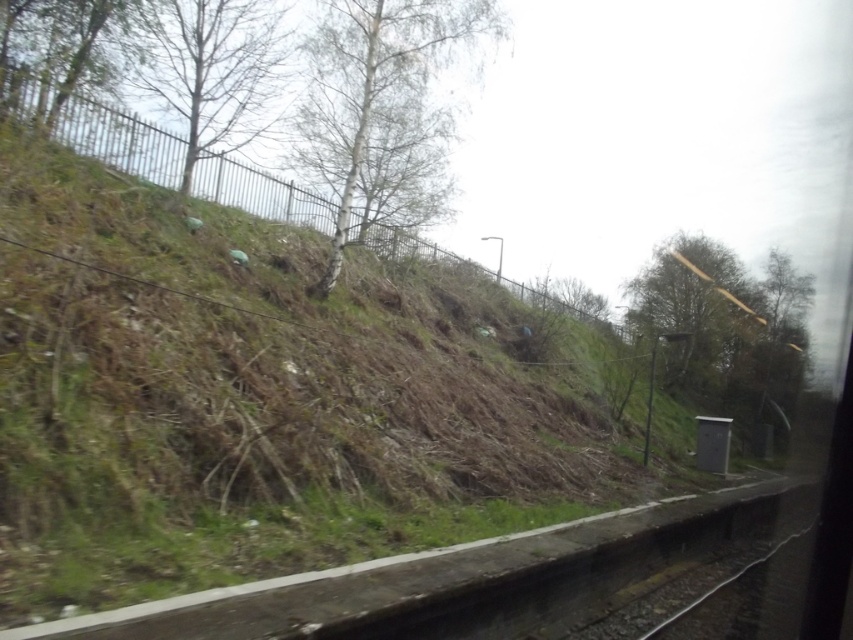
You are a passenger looking out the window of the train and see the green leafy tree at upper center and the green leafy tree at upper left. Which tree is positioned more to the right side of the window?

The green leafy tree at upper center is positioned to the right of the green leafy tree at upper left, so the green leafy tree at upper center is more to the right side of the window.